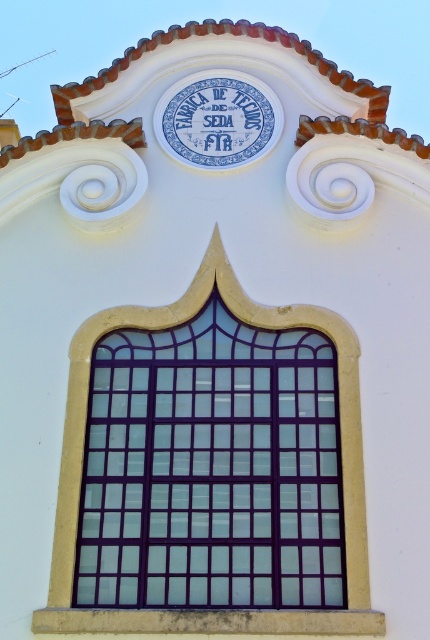
Which is below, purple glass window at center or blue ceramic sign at center?

purple glass window at center is below.

Is point (319, 356) behind point (180, 161)?

No, (319, 356) is in front of (180, 161).

Identify the location of purple glass window at center. (211, 468).